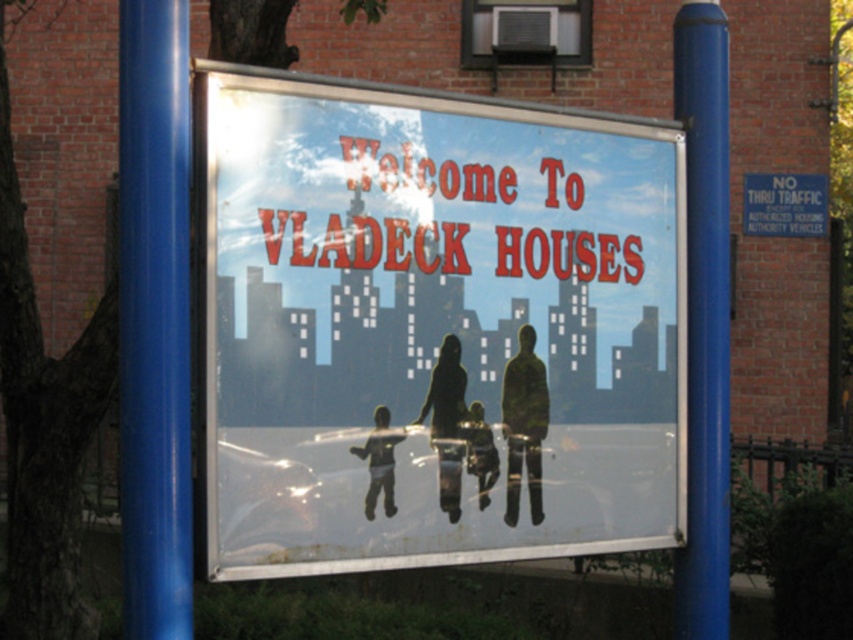
Question: Does transparent plastic sign at center have a lesser width compared to blue glossy pole at center?

Choices:
 (A) no
 (B) yes

Answer: (A)

Question: Can you confirm if silhouette figure at center is positioned above smooth plastic child at center?

Choices:
 (A) no
 (B) yes

Answer: (B)

Question: Based on their relative distances, which object is nearer to the blue glossy pole at center?

Choices:
 (A) transparent plastic sign at center
 (B) silhouette figure at center

Answer: (A)

Question: Which object is closer to the camera taking this photo?

Choices:
 (A) smooth plastic child at center
 (B) silhouette figure at center
 (C) blue glossy pole at center
 (D) transparent plastic sign at center

Answer: (C)

Question: Is transparent plastic sign at center wider than dark matte figure at center?

Choices:
 (A) yes
 (B) no

Answer: (A)

Question: Which point is farther from the camera taking this photo?

Choices:
 (A) (531, 480)
 (B) (724, 573)
 (C) (479, 451)
 (D) (387, 461)

Answer: (B)